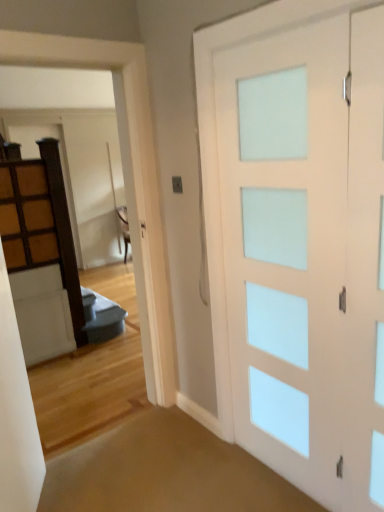
Question: From a real-world perspective, is wooden cabinet at left above or below white frosted glass door at upper center?

Choices:
 (A) above
 (B) below

Answer: (A)

Question: From the image's perspective, is wooden cabinet at left located above or below white frosted glass door at upper center?

Choices:
 (A) above
 (B) below

Answer: (A)

Question: Considering the real-world distances, which object is farthest from the white frosted glass door at upper center?

Choices:
 (A) white frosted glass barn door at right
 (B) wooden cabinet at left

Answer: (B)

Question: Which object is the closest to the white frosted glass door at upper center?

Choices:
 (A) wooden cabinet at left
 (B) white frosted glass barn door at right

Answer: (B)